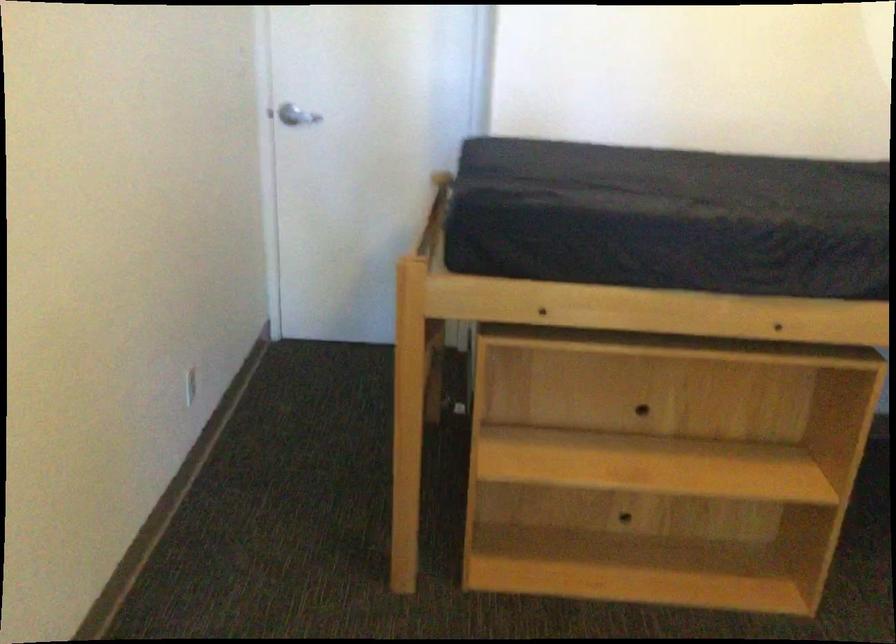
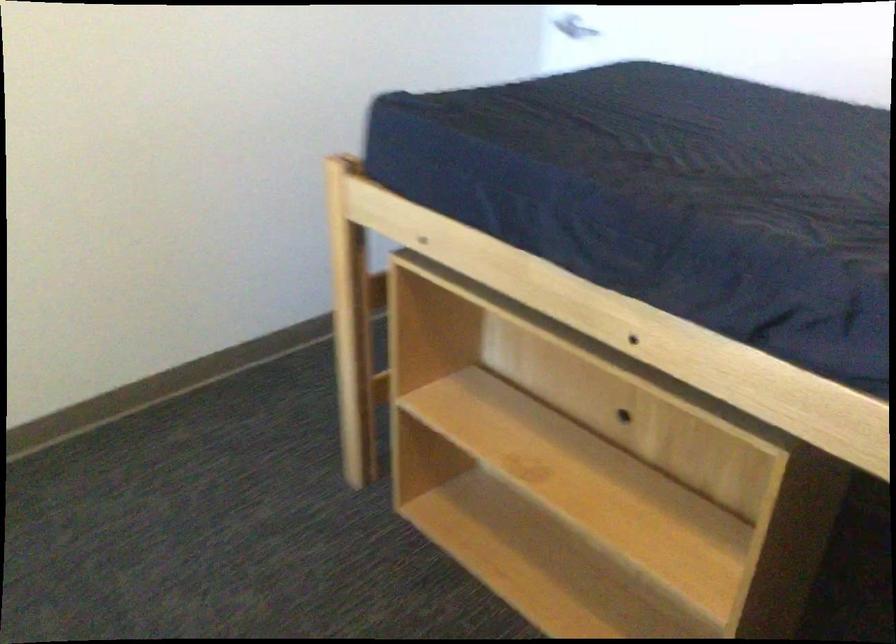
Question: I am providing you with two images of the same scene from different viewpoints. After the viewpoint changes to image2, which objects are now occluded?

Choices:
 (A) white wall outlet
 (B) dark blue mattress
 (C) wooden bed frame rail
 (D) white telephone handset

Answer: (A)